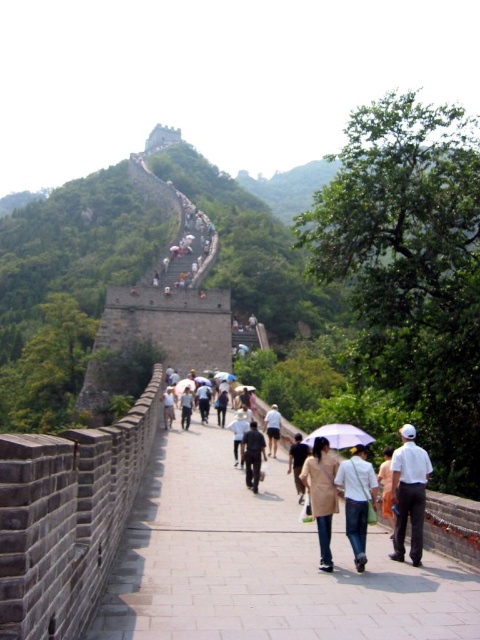
You are a photographer standing on the Great Wall and want to take a photo of the white matte umbrella at center and the white cotton shirt at center. Which object should you focus on first if you want to capture both in the same frame without moving the camera?

You should focus on the white cotton shirt at center first because it is shorter than the white matte umbrella at center, allowing both to be in the same frame by adjusting the camera angle to include the taller umbrella.

You are standing on the Great Wall of China and see a beige fabric coat at center and a white cotton shirt at center. Which clothing item is shorter in height?

The beige fabric coat at center is shorter in height compared to the white cotton shirt at center.